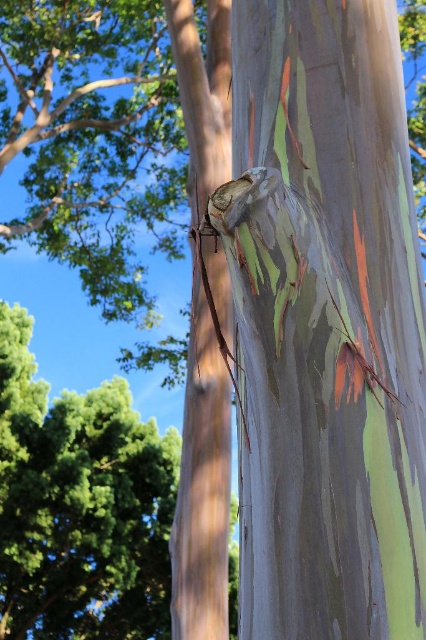
Question: Which object appears farthest from the camera in this image?

Choices:
 (A) smooth gray bark at center
 (B) multicolored bark tree trunk at center

Answer: (A)

Question: Does multicolored bark tree trunk at center appear under smooth gray bark at center?

Choices:
 (A) no
 (B) yes

Answer: (A)

Question: Which point is closer to the camera?

Choices:
 (A) (412, 392)
 (B) (203, 76)

Answer: (A)

Question: Can you confirm if multicolored bark tree trunk at center is positioned to the right of smooth gray bark at center?

Choices:
 (A) yes
 (B) no

Answer: (A)

Question: Is the position of multicolored bark tree trunk at center more distant than that of smooth gray bark at center?

Choices:
 (A) yes
 (B) no

Answer: (B)